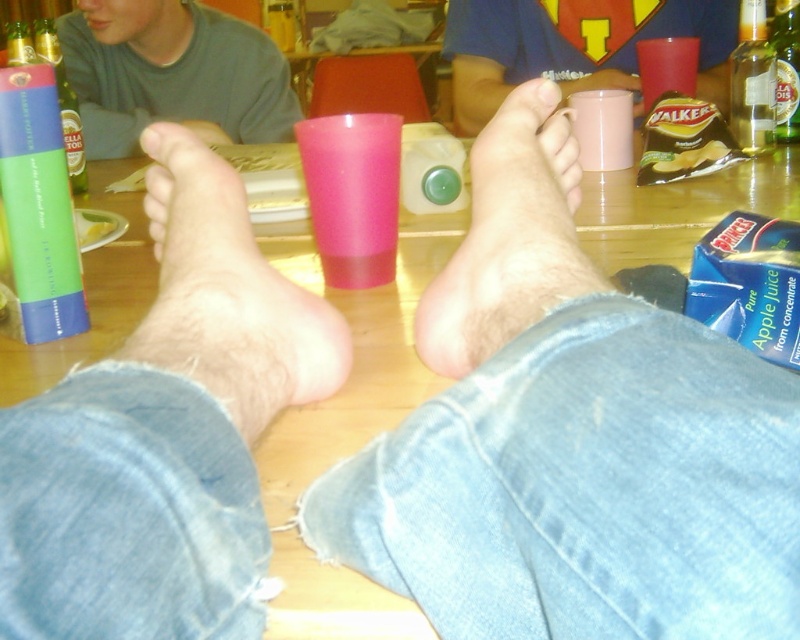
Question: Which object is closer to the camera taking this photo?

Choices:
 (A) green matte bottle at upper left
 (B) hairy skin foot at center
 (C) pink matte mug at upper center

Answer: (B)

Question: Can you confirm if clear glass bottle at upper right is wider than smooth skin toe at center?

Choices:
 (A) no
 (B) yes

Answer: (B)

Question: Can you confirm if clear glass bottle at upper right is positioned to the right of green glass bottle at left?

Choices:
 (A) no
 (B) yes

Answer: (B)

Question: Considering the relative positions of pink matte mug at upper center and translucent glass bottle at upper right in the image provided, where is pink matte mug at upper center located with respect to translucent glass bottle at upper right?

Choices:
 (A) above
 (B) below

Answer: (A)

Question: Which point is farther to the camera?

Choices:
 (A) (548, 86)
 (B) (64, 104)

Answer: (B)

Question: Which of the following is the farthest from the observer?

Choices:
 (A) (144, 152)
 (B) (488, 20)
 (C) (746, 141)

Answer: (B)